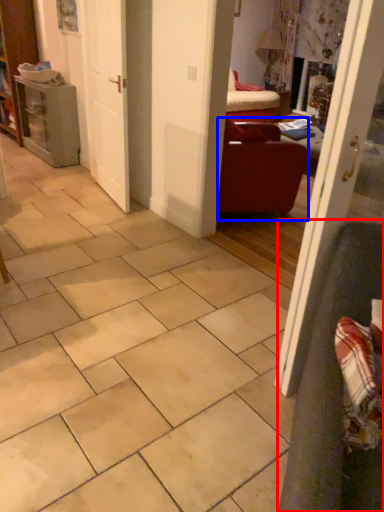
Question: Which point is closer to the camera, armchair (highlighted by a red box) or furniture (highlighted by a blue box)?

Choices:
 (A) armchair
 (B) furniture

Answer: (A)